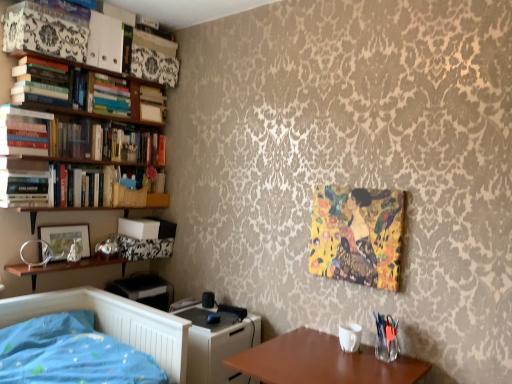
Question: Considering the relative sizes of hardcover books at upper left, which is the fourth book from bottom to top, and matte wood shelf at upper left in the image provided, is hardcover books at upper left, which is the fourth book from bottom to top, thinner than matte wood shelf at upper left?

Choices:
 (A) no
 (B) yes

Answer: (B)

Question: Is hardcover books at upper left, acting as the 3th book starting from the top, located outside matte wood shelf at upper left?

Choices:
 (A) no
 (B) yes

Answer: (B)

Question: From a real-world perspective, is hardcover books at upper left, which is the fourth book from bottom to top, on matte wood shelf at upper left?

Choices:
 (A) yes
 (B) no

Answer: (B)

Question: Is hardcover books at upper left, acting as the 3th book starting from the top, taller than matte wood shelf at upper left?

Choices:
 (A) no
 (B) yes

Answer: (A)

Question: From the image's perspective, is hardcover books at upper left, which is the fourth book from bottom to top, over matte wood shelf at upper left?

Choices:
 (A) no
 (B) yes

Answer: (B)

Question: From the image's perspective, is matte wood shelf at upper left beneath hardcover books at upper left, which ranks as the 1th book in top-to-bottom order?

Choices:
 (A) no
 (B) yes

Answer: (B)

Question: Does matte wood shelf at upper left have a greater width compared to hardcover books at upper left, the 6th book when ordered from bottom to top?

Choices:
 (A) no
 (B) yes

Answer: (A)

Question: Does matte wood shelf at upper left have a lesser width compared to hardcover books at upper left, which ranks as the 1th book in top-to-bottom order?

Choices:
 (A) no
 (B) yes

Answer: (B)

Question: Is matte wood shelf at upper left bigger than hardcover books at upper left, the 6th book when ordered from bottom to top?

Choices:
 (A) no
 (B) yes

Answer: (A)

Question: Considering the relative positions of matte wood shelf at upper left and hardcover books at upper left, the 6th book when ordered from bottom to top, in the image provided, is matte wood shelf at upper left to the right of hardcover books at upper left, the 6th book when ordered from bottom to top, from the viewer's perspective?

Choices:
 (A) no
 (B) yes

Answer: (B)

Question: Is hardcover books at upper left, which ranks as the 1th book in top-to-bottom order, surrounded by matte wood shelf at upper left?

Choices:
 (A) no
 (B) yes

Answer: (A)

Question: Is hardcover book at left, which appears as the first book when ordered from the bottom, oriented towards hardcover books at upper left, the 6th book when ordered from bottom to top?

Choices:
 (A) yes
 (B) no

Answer: (B)